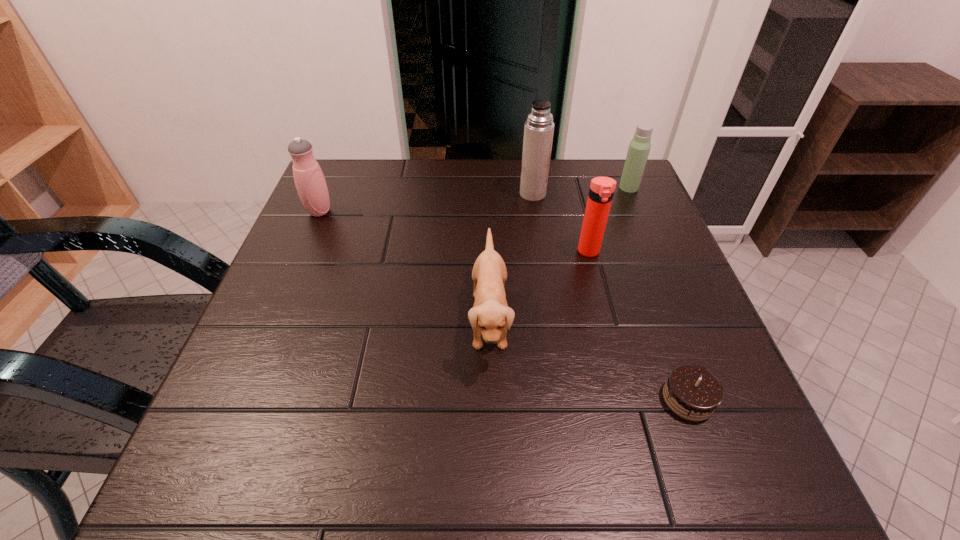
Locate an element on the screen. This screenshot has height=540, width=960. object situated at the far left corner is located at coordinates (309, 179).

In order to click on object that is positioned at the far right corner in this screenshot , I will do `click(639, 147)`.

Where is `free region at the far edge of the desktop`? free region at the far edge of the desktop is located at coordinates (415, 167).

The image size is (960, 540). In the image, there is a desktop. Identify the location of vacant space at the near edge. (507, 488).

This screenshot has height=540, width=960. In the image, there is a desktop. What are the coordinates of `vacant space at the left edge` in the screenshot? It's located at 329,304.

Identify the location of vacant space at the right edge. (637, 227).

This screenshot has height=540, width=960. Find the location of `free space at the far left corner of the desktop`. free space at the far left corner of the desktop is located at coordinates tap(343, 177).

In order to click on blank area at the far right corner in this screenshot , I will do `click(588, 183)`.

I want to click on free space between the fourth object from left to right and the second shortest object, so click(x=540, y=286).

I want to click on free space between the leftmost object and the rightmost thermos bottle, so click(x=474, y=199).